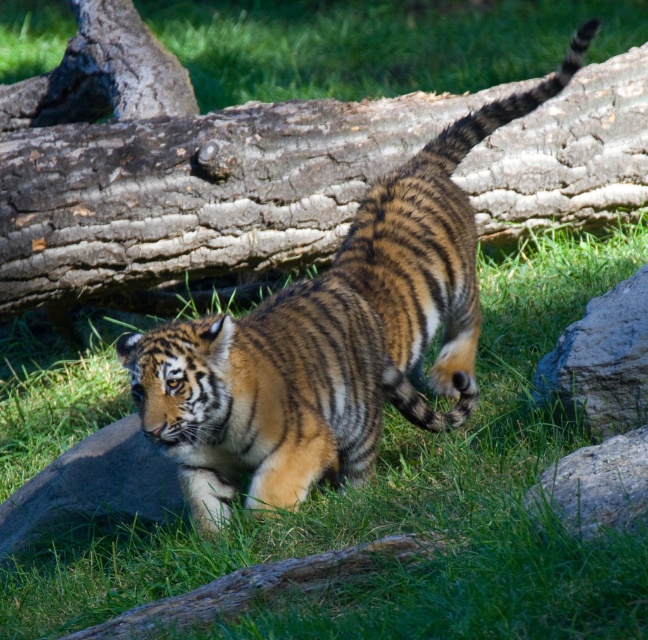
Question: Which of these objects is positioned farthest from the brown rough bark log at center?

Choices:
 (A) gray rough rock at right
 (B) green grass at center
 (C) gray smooth rock at lower left

Answer: (B)

Question: Estimate the real-world distances between objects in this image. Which object is farther from the striped fur tiger at center?

Choices:
 (A) gray smooth rock at lower left
 (B) brown rough bark log at center

Answer: (B)

Question: In this image, where is green grass at center located relative to gray rough rock at right?

Choices:
 (A) left
 (B) right

Answer: (A)

Question: Is brown rough bark log at center above striped fur tiger at center?

Choices:
 (A) no
 (B) yes

Answer: (B)

Question: Does green grass at center have a smaller size compared to striped fur tiger at center?

Choices:
 (A) yes
 (B) no

Answer: (A)

Question: Based on their relative distances, which object is farther from the gray smooth rock at lower left?

Choices:
 (A) green grass at center
 (B) gray rough rock at right
 (C) striped fur tiger at center
 (D) brown rough bark log at center

Answer: (B)